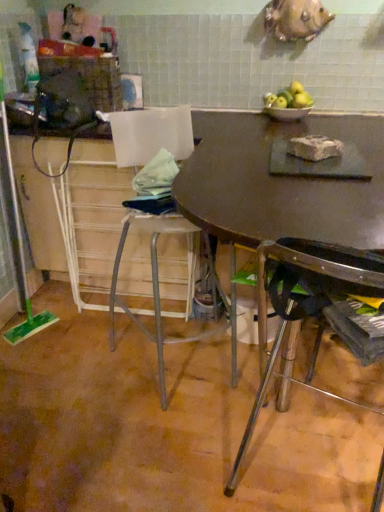
You are a GUI agent. You are given a task and a screenshot of the screen. Output one action in this format:
    pyautogui.click(x=<x>, y=<y>)
    Task: Click on the vacant region to the left of matte brown table at center
    The image size is (384, 512).
    Given the screenshot: What is the action you would take?
    pyautogui.click(x=78, y=404)